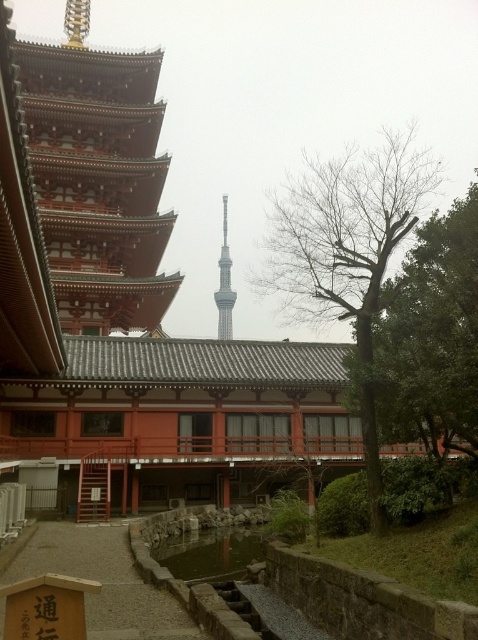
Question: Among these objects, which one is nearest to the camera?

Choices:
 (A) wooden sign at lower left
 (B) smooth glass tower at center

Answer: (A)

Question: Which point is closer to the camera taking this photo?

Choices:
 (A) (3, 602)
 (B) (219, 280)

Answer: (A)

Question: Is wooden sign at lower left closer to camera compared to smooth glass tower at center?

Choices:
 (A) yes
 (B) no

Answer: (A)

Question: Is wooden sign at lower left closer to camera compared to smooth glass tower at center?

Choices:
 (A) yes
 (B) no

Answer: (A)

Question: From the image, what is the correct spatial relationship of wooden sign at lower left in relation to smooth glass tower at center?

Choices:
 (A) below
 (B) above

Answer: (A)

Question: Which point is farther from the camera taking this photo?

Choices:
 (A) (232, 305)
 (B) (58, 536)

Answer: (A)